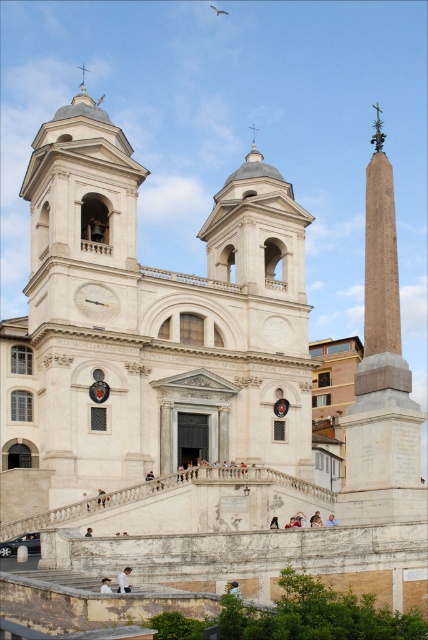
Is white fabric person at lower center smaller than light brown leather jacket at center?

Yes, white fabric person at lower center is smaller than light brown leather jacket at center.

Between white fabric person at lower center and light brown leather jacket at center, which one appears on the left side from the viewer's perspective?

From the viewer's perspective, light brown leather jacket at center appears more on the left side.

This screenshot has height=640, width=428. In order to click on white fabric person at lower center in this screenshot , I will do `click(124, 580)`.

Which is more to the right, smooth stone obelisk at right or white fabric person at lower center?

Positioned to the right is smooth stone obelisk at right.

Which is in front, point (391, 192) or point (118, 576)?

Point (118, 576)

Where is `smooth stone obelisk at right`? smooth stone obelisk at right is located at coordinates (382, 378).

The image size is (428, 640). What do you see at coordinates (382, 378) in the screenshot?
I see `smooth stone obelisk at right` at bounding box center [382, 378].

Does smooth stone obelisk at right appear on the left side of blue denim jeans at lower center?

No, smooth stone obelisk at right is not to the left of blue denim jeans at lower center.

You are a GUI agent. You are given a task and a screenshot of the screen. Output one action in this format:
    pyautogui.click(x=<x>, y=<y>)
    Task: Click on the smooth stone obelisk at right
    The image size is (428, 640).
    Given the screenshot: What is the action you would take?
    pyautogui.click(x=382, y=378)